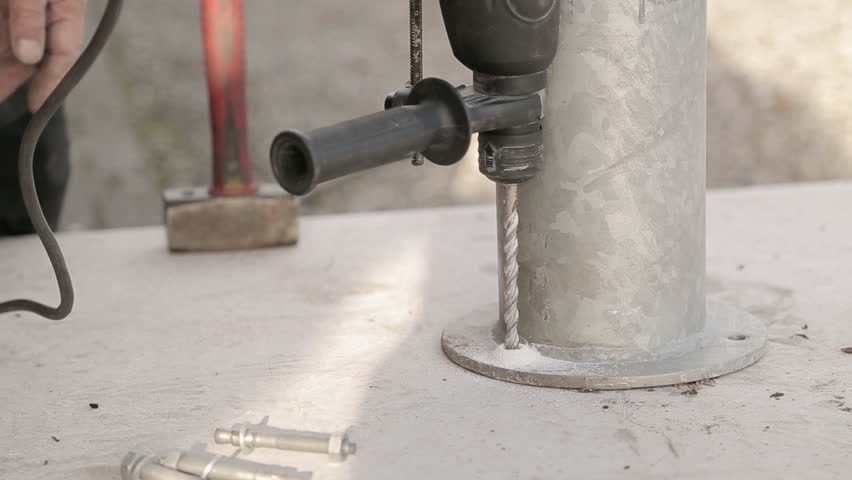
In order to click on black wire in this screenshot , I will do `click(32, 135)`.